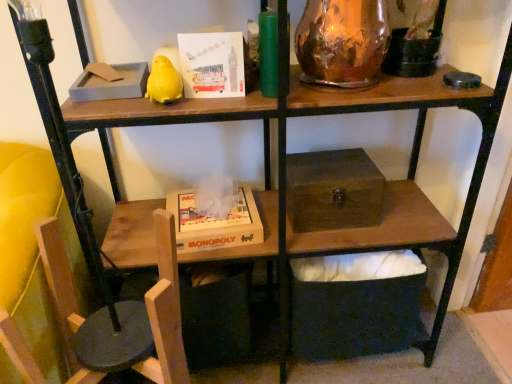
Question: From a real-world perspective, is wooden box at center, placed as the second box when sorted from top to bottom, under wooden chair at lower left?

Choices:
 (A) yes
 (B) no

Answer: (B)

Question: Does wooden box at center, placed as the second box when sorted from top to bottom, come behind wooden chair at lower left?

Choices:
 (A) yes
 (B) no

Answer: (B)

Question: From a real-world perspective, is wooden box at center, acting as the first box starting from the bottom, on wooden chair at lower left?

Choices:
 (A) no
 (B) yes

Answer: (B)

Question: Could you tell me if wooden box at center, acting as the first box starting from the bottom, is turned towards wooden chair at lower left?

Choices:
 (A) yes
 (B) no

Answer: (B)

Question: Is wooden box at center, acting as the first box starting from the bottom, shorter than wooden chair at lower left?

Choices:
 (A) yes
 (B) no

Answer: (B)

Question: Is wooden box at center, placed as the second box when sorted from top to bottom, with wooden chair at lower left?

Choices:
 (A) yes
 (B) no

Answer: (B)

Question: Considering the relative sizes of wooden chair at lower left and matte paper card at upper center in the image provided, is wooden chair at lower left wider than matte paper card at upper center?

Choices:
 (A) no
 (B) yes

Answer: (B)

Question: Is wooden chair at lower left positioned behind matte paper card at upper center?

Choices:
 (A) no
 (B) yes

Answer: (B)

Question: Considering the relative sizes of wooden chair at lower left and matte paper card at upper center in the image provided, is wooden chair at lower left bigger than matte paper card at upper center?

Choices:
 (A) yes
 (B) no

Answer: (A)

Question: Is wooden chair at lower left at the right side of matte paper card at upper center?

Choices:
 (A) yes
 (B) no

Answer: (A)

Question: Would you consider wooden chair at lower left to be distant from matte paper card at upper center?

Choices:
 (A) yes
 (B) no

Answer: (B)

Question: Is wooden chair at lower left taller than matte paper card at upper center?

Choices:
 (A) no
 (B) yes

Answer: (A)

Question: Does copper metallic vase at upper right contain matte paper card at upper center?

Choices:
 (A) yes
 (B) no

Answer: (B)